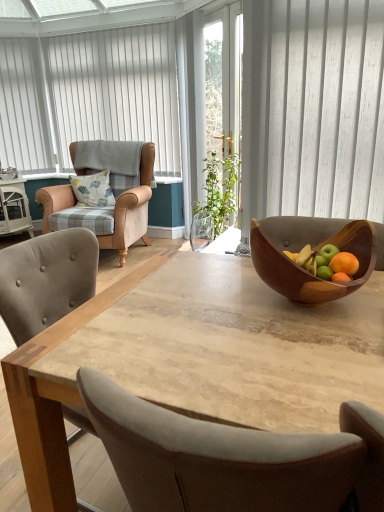
Where is `beige leather armchair at left`? The height and width of the screenshot is (512, 384). beige leather armchair at left is located at coordinates (132, 210).

Find the location of a particular element. transparent glass screen door at center is located at coordinates (222, 92).

What do you see at coordinates (14, 208) in the screenshot? This screenshot has height=512, width=384. I see `white glossy side table at left` at bounding box center [14, 208].

The image size is (384, 512). I want to click on beige leather armchair at left, so pos(132,210).

Is transparent glass screen door at center wider than white vertical blinds at upper left?

Yes.

Between transparent glass screen door at center and white vertical blinds at upper left, which one has more height?

With more height is transparent glass screen door at center.

Could you tell me if transparent glass screen door at center is turned towards white vertical blinds at upper left?

No, transparent glass screen door at center does not turn towards white vertical blinds at upper left.

Where is `curtain above the transparent glass screen door at center (from a real-world perspective)`? curtain above the transparent glass screen door at center (from a real-world perspective) is located at coordinates (116, 90).

I want to click on curtain on the right of white glossy side table at left, so click(x=116, y=90).

Are white vertical blinds at upper left and white glossy side table at left located far from each other?

Absolutely, white vertical blinds at upper left is distant from white glossy side table at left.

From the image's perspective, is white vertical blinds at upper left located beneath white glossy side table at left?

No, from the image's perspective, white vertical blinds at upper left is not beneath white glossy side table at left.

Is point (124, 375) closer to viewer compared to point (287, 285)?

Yes, point (124, 375) is closer to viewer.

Based on the photo, is natural wood table at center wider or thinner than wooden bowl at center?

Clearly, natural wood table at center has more width compared to wooden bowl at center.

From the image's perspective, which is below, natural wood table at center or wooden bowl at center?

natural wood table at center is shown below in the image.

Would you say natural wood table at center is to the left or to the right of wooden bowl at center in the picture?

Clearly, natural wood table at center is on the left of wooden bowl at center in the image.

From a real-world perspective, is wooden bowl at center beneath white glossy side table at left?

No, from a real-world perspective, wooden bowl at center is not beneath white glossy side table at left.

Is wooden bowl at center thinner than white glossy side table at left?

Yes, wooden bowl at center is thinner than white glossy side table at left.

From the image's perspective, which one is positioned higher, wooden bowl at center or white glossy side table at left?

white glossy side table at left.

Considering the positions of objects white vertical blinds at upper left and beige leather armchair at left in the image provided, who is more to the right, white vertical blinds at upper left or beige leather armchair at left?

Positioned to the right is beige leather armchair at left.

From the image's perspective, which object appears higher, white vertical blinds at upper left or beige leather armchair at left?

white vertical blinds at upper left is shown above in the image.

Does white vertical blinds at upper left turn towards beige leather armchair at left?

Yes, white vertical blinds at upper left is aimed at beige leather armchair at left.

From the image's perspective, is white vertical blinds at upper left located above white glossy side table at left?

Yes, from the image's perspective, white vertical blinds at upper left is on top of white glossy side table at left.

Does white vertical blinds at upper left lie behind white glossy side table at left?

Yes.

Which is correct: white vertical blinds at upper left is inside white glossy side table at left, or outside of it?

The correct answer is: outside.

Based on the photo, would you consider white vertical blinds at upper left to be distant from white glossy side table at left?

white vertical blinds at upper left is near white glossy side table at left, not far away.

Does point (6, 162) come closer to viewer compared to point (79, 198)?

No, it is not.

Based on the photo, from the image's perspective, is white vertical blinds at upper left positioned above or below floral fabric pillow at left?

white vertical blinds at upper left is above floral fabric pillow at left.

Considering the relative sizes of white vertical blinds at upper left and floral fabric pillow at left in the image provided, is white vertical blinds at upper left bigger than floral fabric pillow at left?

Correct, white vertical blinds at upper left is larger in size than floral fabric pillow at left.

Locate an element on the screen. This screenshot has height=512, width=384. curtain lying on the left of transparent glass screen door at center is located at coordinates (116, 90).

I want to click on side table behind the white vertical blinds at upper left, so click(14, 208).

Looking at the image, which one is located further to transparent glass screen door at center, natural wood table at center or white vertical blinds at upper left?

natural wood table at center lies further to transparent glass screen door at center than the other object.

Considering their positions, is transparent glass screen door at center positioned further to floral fabric pillow at left than white vertical blinds at upper left?

white vertical blinds at upper left lies further to floral fabric pillow at left than the other object.

Looking at the image, which one is located closer to white vertical blinds at upper left, white vertical blinds at upper left or transparent glass screen door at center?

Among the two, white vertical blinds at upper left is located nearer to white vertical blinds at upper left.

Looking at the image, which one is located further to wooden bowl at center, white vertical blinds at upper left or beige leather armchair at left?

Based on the image, white vertical blinds at upper left appears to be further to wooden bowl at center.

Which object lies nearer to the anchor point transparent glass screen door at center, white vertical blinds at upper left or beige leather armchair at left?

Among the two, beige leather armchair at left is located nearer to transparent glass screen door at center.

When comparing their distances from natural wood table at center, does floral fabric pillow at left or wooden bowl at center seem further?

The object further to natural wood table at center is floral fabric pillow at left.

Considering their positions, is floral fabric pillow at left positioned closer to beige leather armchair at left than white vertical blinds at upper left?

floral fabric pillow at left is closer to beige leather armchair at left.

When comparing their distances from white vertical blinds at upper left, does natural wood table at center or floral fabric pillow at left seem further?

Based on the image, natural wood table at center appears to be further to white vertical blinds at upper left.

Identify the location of bowl located between natural wood table at center and transparent glass screen door at center in the depth direction. (312, 248).

I want to click on curtain located between natural wood table at center and floral fabric pillow at left in the depth direction, so click(116, 90).

In order to click on curtain located between white glossy side table at left and beige leather armchair at left in the left-right direction in this screenshot , I will do `click(116, 90)`.

The height and width of the screenshot is (512, 384). I want to click on curtain between wooden bowl at center and white vertical blinds at upper left from front to back, so click(116, 90).